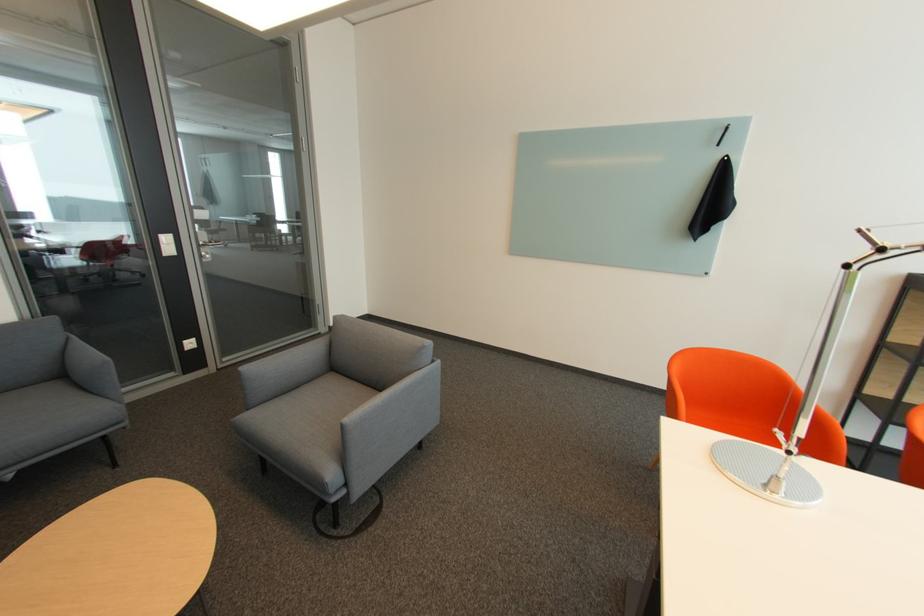
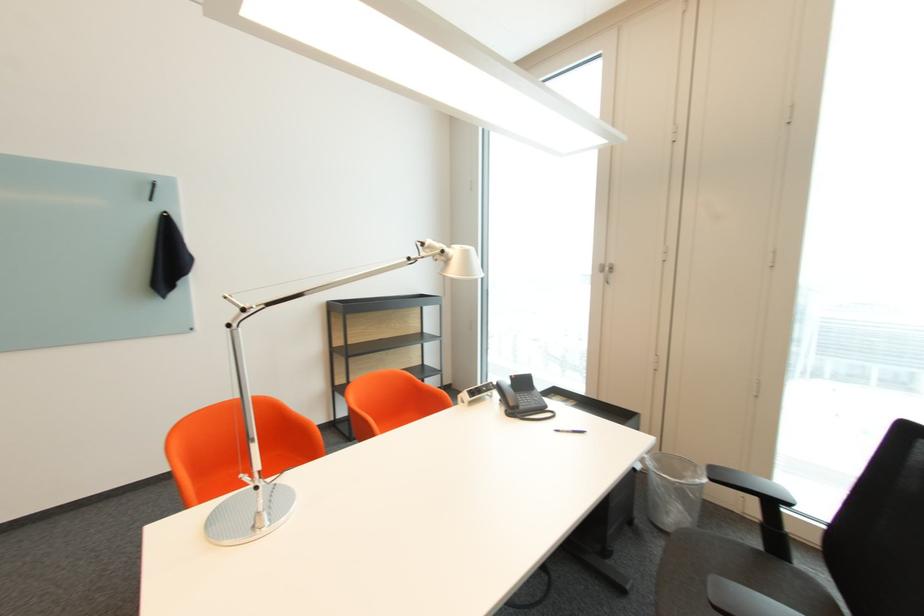
Where in the second image is the point corresponding to pixel 807 439 from the first image?

(265, 472)